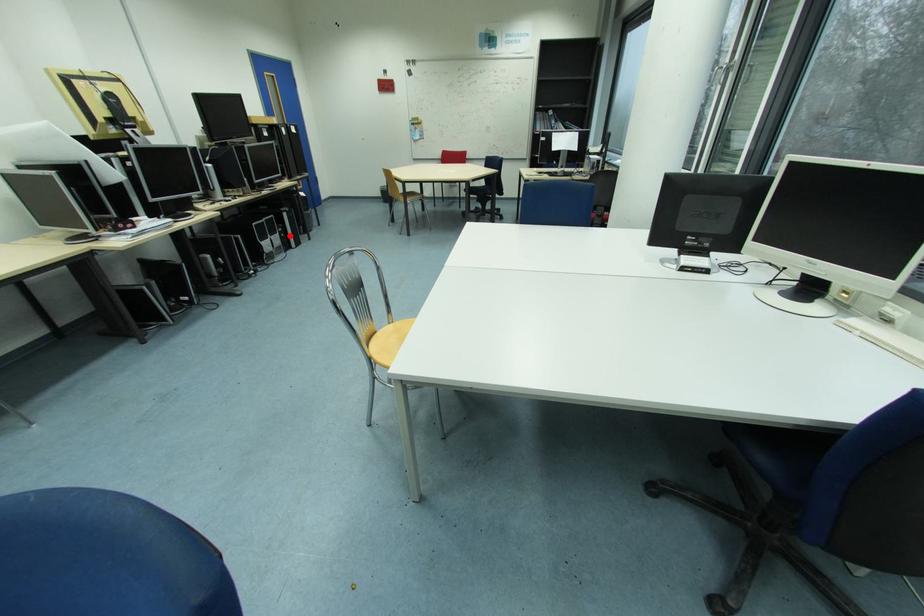
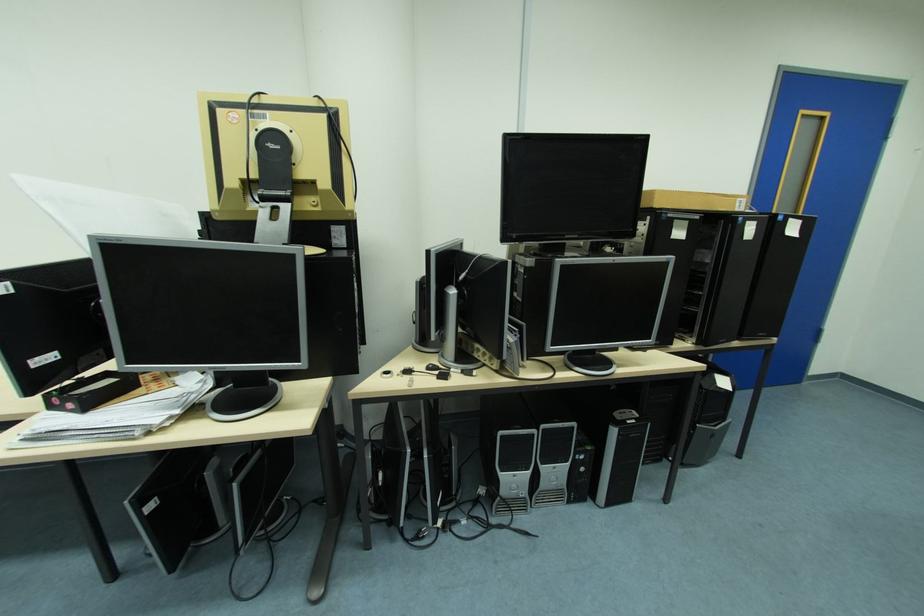
Find the pixel in the second image that matches the highlighted location in the first image.

(590, 469)